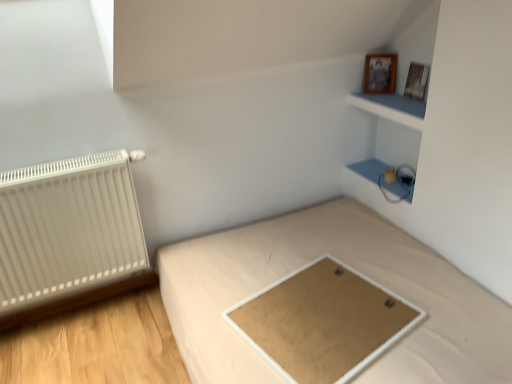
This screenshot has height=384, width=512. Identify the location of vacant area that lies in front of wooden photo frame at upper right, marked as the 2th picture frame in a right-to-left arrangement. (387, 102).